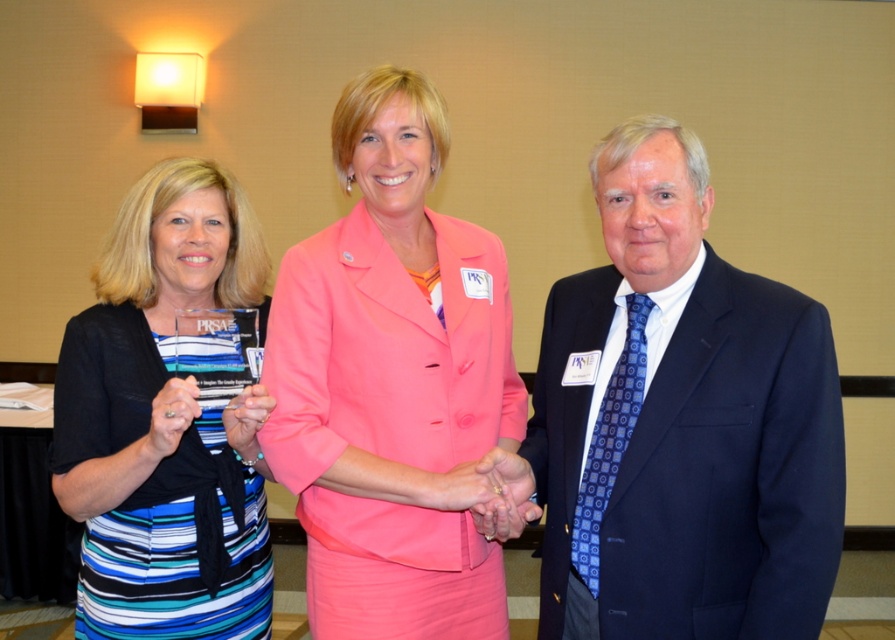
Question: Does pink fabric jacket at center have a lesser width compared to striped fabric dress at center?

Choices:
 (A) yes
 (B) no

Answer: (A)

Question: Considering the real-world distances, which object is closest to the pink fabric jacket at center?

Choices:
 (A) navy blue suit at center
 (B) striped fabric dress at center

Answer: (A)

Question: Does navy blue suit at center have a smaller size compared to striped fabric dress at center?

Choices:
 (A) yes
 (B) no

Answer: (A)

Question: Which object appears farthest from the camera in this image?

Choices:
 (A) navy blue suit at center
 (B) striped fabric dress at center

Answer: (B)

Question: Among these points, which one is farthest from the camera?

Choices:
 (A) (651, 266)
 (B) (118, 244)
 (C) (397, 145)

Answer: (B)

Question: Does pink fabric jacket at center have a lesser width compared to striped fabric dress at center?

Choices:
 (A) no
 (B) yes

Answer: (B)